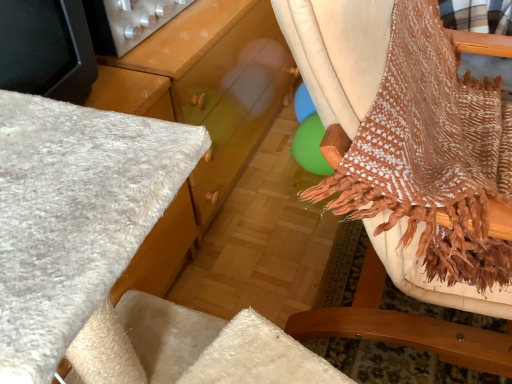
Question: Considering the relative positions of metallic silver knobs at upper left and brown woven fabric at right in the image provided, is metallic silver knobs at upper left to the left or to the right of brown woven fabric at right?

Choices:
 (A) left
 (B) right

Answer: (A)

Question: Considering the positions of metallic silver knobs at upper left and brown woven fabric at right in the image, is metallic silver knobs at upper left wider or thinner than brown woven fabric at right?

Choices:
 (A) wide
 (B) thin

Answer: (B)

Question: In terms of height, does metallic silver knobs at upper left look taller or shorter compared to brown woven fabric at right?

Choices:
 (A) tall
 (B) short

Answer: (B)

Question: Is brown woven fabric at right inside the boundaries of metallic silver knobs at upper left, or outside?

Choices:
 (A) outside
 (B) inside

Answer: (A)

Question: Visually, is brown woven fabric at right positioned to the left or to the right of metallic silver knobs at upper left?

Choices:
 (A) left
 (B) right

Answer: (B)

Question: Is brown woven fabric at right wider or thinner than metallic silver knobs at upper left?

Choices:
 (A) wide
 (B) thin

Answer: (A)

Question: In terms of height, does brown woven fabric at right look taller or shorter compared to metallic silver knobs at upper left?

Choices:
 (A) tall
 (B) short

Answer: (A)